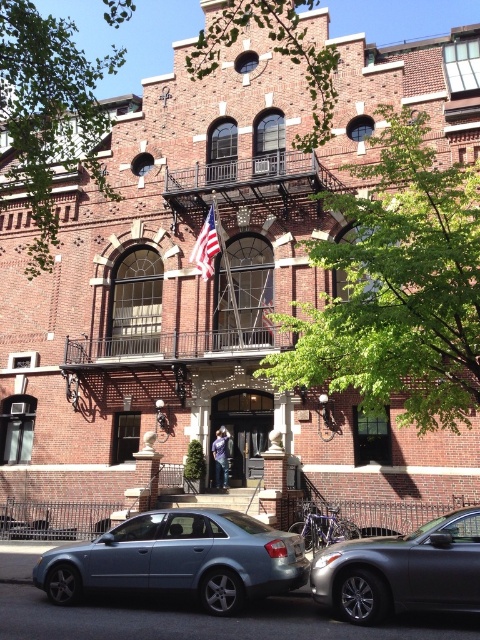
Question: Which of the following is the closest to the observer?

Choices:
 (A) satin blue sedan at lower center
 (B) american flag at center

Answer: (A)

Question: Can you confirm if metallic gray sedan at lower right is thinner than american flag at center?

Choices:
 (A) yes
 (B) no

Answer: (B)

Question: Is satin blue sedan at lower center to the right of american flag at center from the viewer's perspective?

Choices:
 (A) yes
 (B) no

Answer: (B)

Question: Which object appears closest to the camera in this image?

Choices:
 (A) metallic gray sedan at lower right
 (B) american flag at center
 (C) satin blue sedan at lower center

Answer: (A)

Question: Which of the following is the farthest from the observer?

Choices:
 (A) satin blue sedan at lower center
 (B) metallic gray sedan at lower right

Answer: (A)

Question: Can you confirm if satin blue sedan at lower center is bigger than metallic gray sedan at lower right?

Choices:
 (A) yes
 (B) no

Answer: (A)